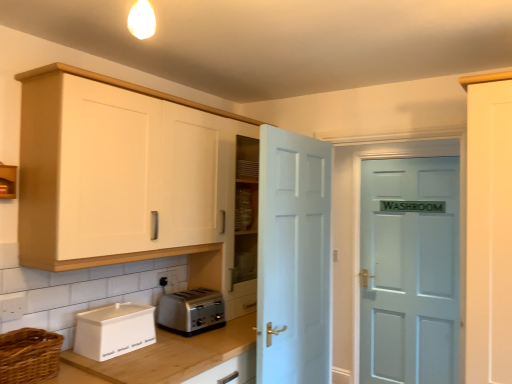
The width and height of the screenshot is (512, 384). In order to click on free space in front of satin silver toaster at lower center in this screenshot , I will do `click(191, 340)`.